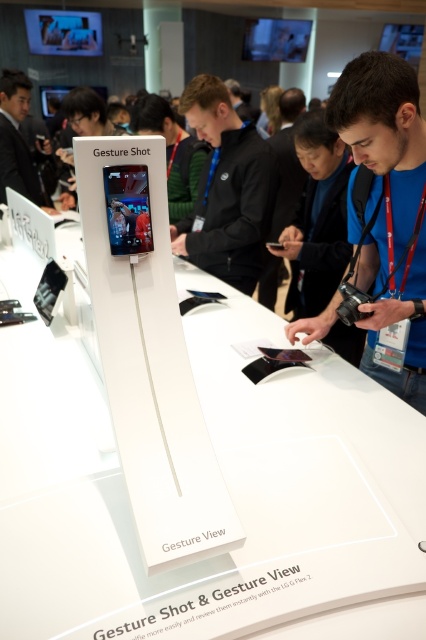
Where is `matte black phone at upper left`? Image resolution: width=426 pixels, height=640 pixels. matte black phone at upper left is located at coordinates (17, 140).

Is matte black phone at upper left thinner than matte black smartphone at center?

In fact, matte black phone at upper left might be wider than matte black smartphone at center.

Is point (8, 120) positioned after point (126, 180)?

Yes, it is behind point (126, 180).

Image resolution: width=426 pixels, height=640 pixels. I want to click on matte black phone at upper left, so click(17, 140).

Is black fabric jacket at center smaller than matte black smartphone at center?

Actually, black fabric jacket at center might be larger than matte black smartphone at center.

Between point (259, 236) and point (103, 172), which one is positioned behind?

The point (259, 236) is behind.

Is point (176, 252) farther from camera compared to point (123, 173)?

Yes, point (176, 252) is farther from viewer.

Where is `black fabric jacket at center`? black fabric jacket at center is located at coordinates (226, 189).

Which of these two, matte black phone at upper left or black glossy smartphone at center, stands taller?

With more height is matte black phone at upper left.

Does point (2, 193) lie behind point (282, 248)?

Yes, it is behind point (282, 248).

Identify the location of matte black phone at upper left. (17, 140).